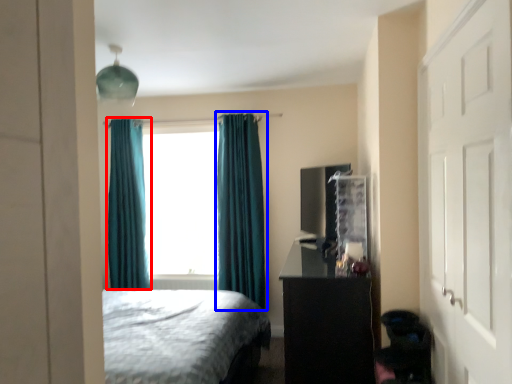
Question: Which point is further to the camera, curtain (highlighted by a red box) or curtain (highlighted by a blue box)?

Choices:
 (A) curtain
 (B) curtain

Answer: (A)